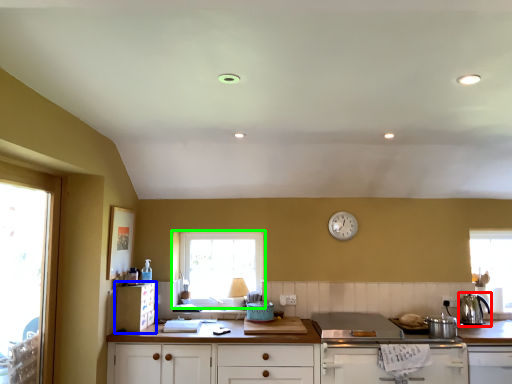
Question: Which is farther away from kitchen appliance (highlighted by a red box)? cabinetry (highlighted by a blue box) or window (highlighted by a green box)?

Choices:
 (A) cabinetry
 (B) window

Answer: (A)